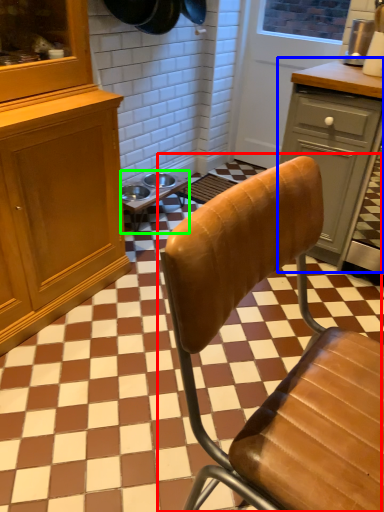
Question: Which object is the farthest from chair (highlighted by a red box)? Choose among these: cabinetry (highlighted by a blue box) or table (highlighted by a green box).

Choices:
 (A) cabinetry
 (B) table

Answer: (B)